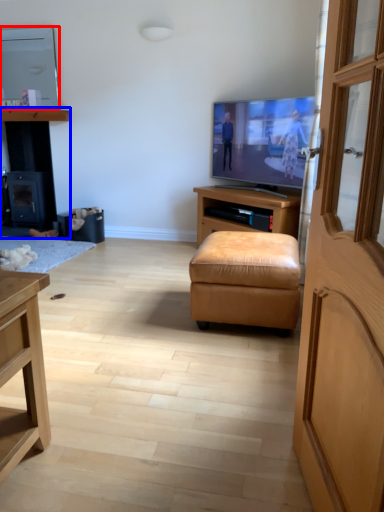
Question: Which of the following is the closest to the observer, television (highlighted by a red box) or dresser (highlighted by a blue box)?

Choices:
 (A) television
 (B) dresser

Answer: (A)